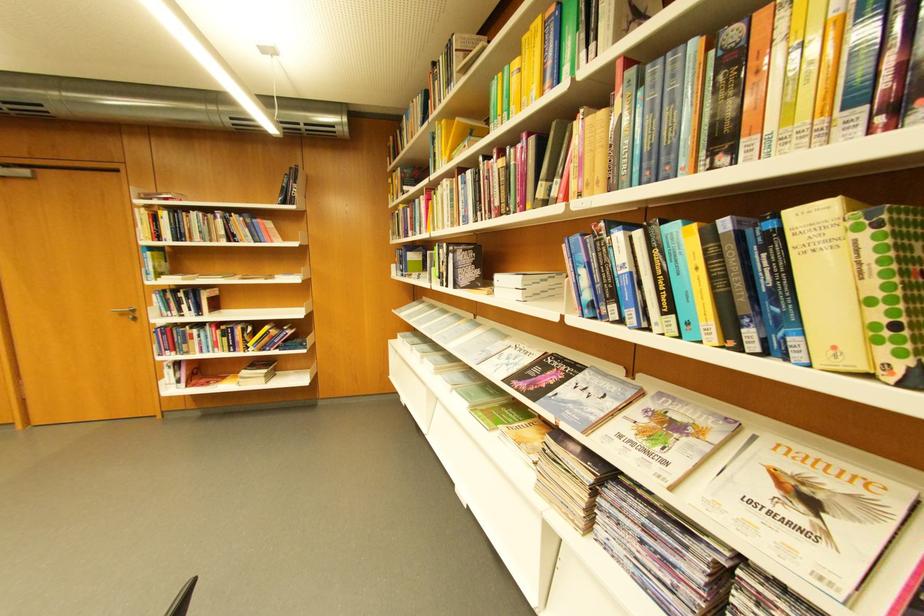
Identify the location of yellow hardcover book. Image resolution: width=924 pixels, height=616 pixels. [827, 284].